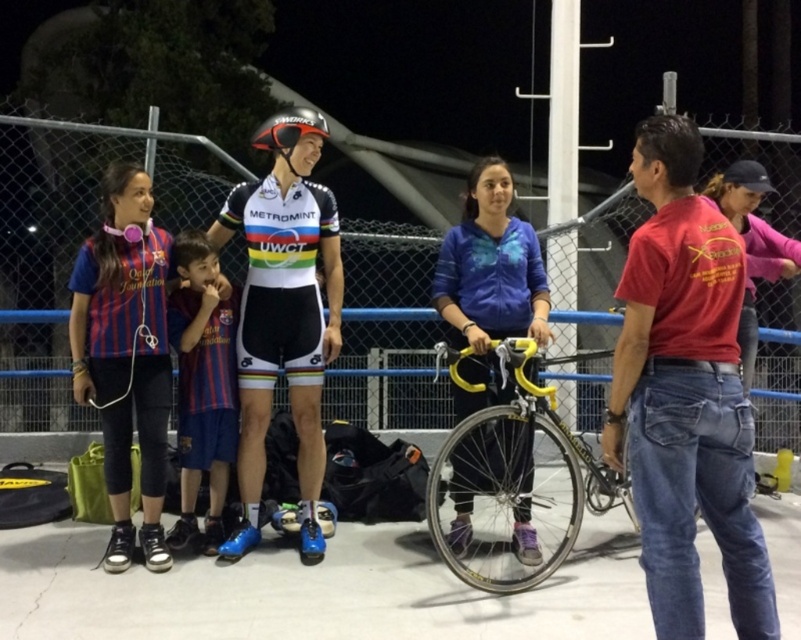
Does yellow metallic bicycle at center appear under blue textured jacket at center?

Correct, yellow metallic bicycle at center is located below blue textured jacket at center.

Does yellow metallic bicycle at center come behind blue textured jacket at center?

No, it is in front of blue textured jacket at center.

Which is behind, point (516, 374) or point (518, 540)?

Positioned behind is point (518, 540).

Find the location of a particular element. This screenshot has width=801, height=640. yellow metallic bicycle at center is located at coordinates (514, 483).

Is blue textured jacket at center positioned at the back of shiny orange helmet at center?

No, blue textured jacket at center is in front of shiny orange helmet at center.

Who is taller, blue textured jacket at center or shiny orange helmet at center?

blue textured jacket at center is taller.

Who is more forward, (506,280) or (264,129)?

Point (506,280) is in front.

Identify the location of blue textured jacket at center. (489, 282).

Between point (671, 499) and point (288, 109), which one is positioned in front?

Point (671, 499) is in front.

Does red cotton shirt at right have a greater width compared to rainbow jersey at center?

No, red cotton shirt at right is not wider than rainbow jersey at center.

Is point (647, 506) positioned before point (274, 140)?

Yes, it is.

I want to click on red cotton shirt at right, so click(x=686, y=394).